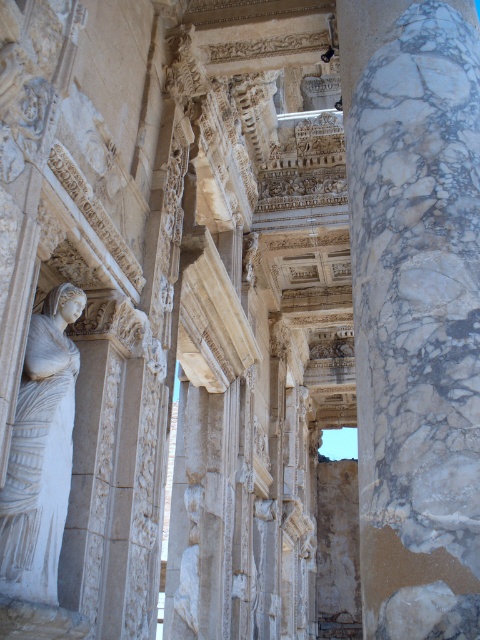
You are an architect examining the ancient structure. You need to determine which object occupies more space in the image. Based on the scene, which is bigger between the marble column at right and the white marble statue at left?

The marble column at right is larger in size than the white marble statue at left, so the marble column at right occupies more space in the image.